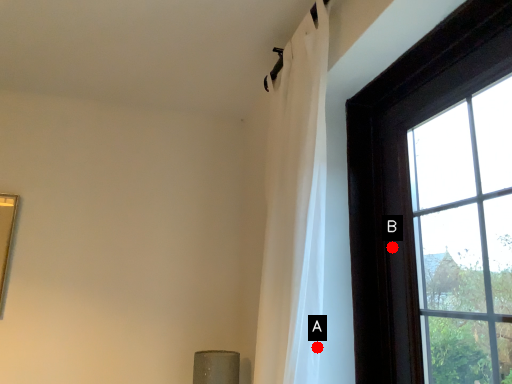
Question: Two points are circled on the image, labeled by A and B beside each circle. Which point is further to the camera?

Choices:
 (A) A is further
 (B) B is further

Answer: (B)